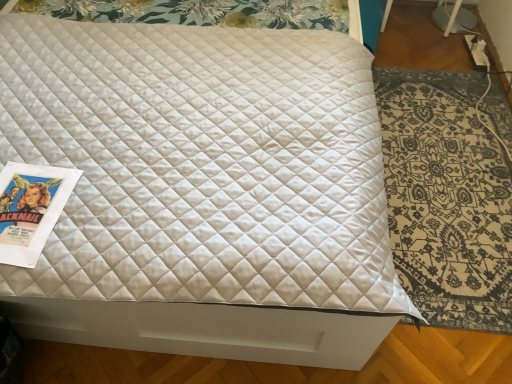
I want to click on beige patterned rug at lower right, so click(x=446, y=198).

What do you see at coordinates (446, 198) in the screenshot? Image resolution: width=512 pixels, height=384 pixels. I see `beige patterned rug at lower right` at bounding box center [446, 198].

This screenshot has width=512, height=384. In order to click on beige patterned rug at lower right in this screenshot , I will do (446, 198).